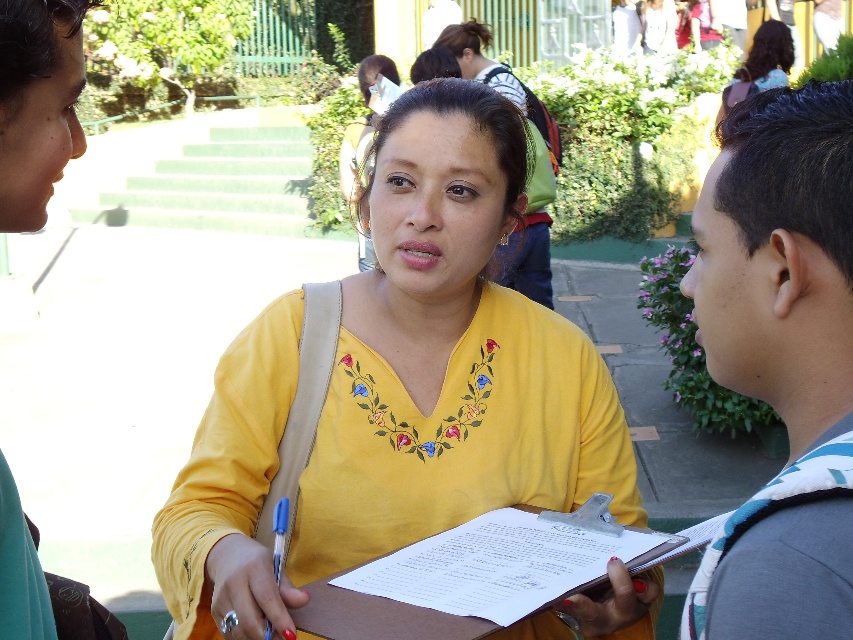
Question: Is yellow embroidered shirt at center below gray fabric backpack at right?

Choices:
 (A) yes
 (B) no

Answer: (A)

Question: Considering the real-world distances, which object is closest to the curly hair at upper right?

Choices:
 (A) brown cardboard clipboard at center
 (B) yellow embroidered shirt at center
 (C) gray fabric backpack at right

Answer: (B)

Question: Which of the following is the farthest from the observer?

Choices:
 (A) [x=735, y=298]
 (B) [x=764, y=36]

Answer: (B)

Question: Which point is closer to the camera?

Choices:
 (A) curly hair at upper right
 (B) brown cardboard clipboard at center

Answer: (B)

Question: Is gray fabric backpack at right behind brown cardboard clipboard at center?

Choices:
 (A) yes
 (B) no

Answer: (B)

Question: Can you confirm if gray fabric backpack at right is thinner than brown cardboard clipboard at center?

Choices:
 (A) yes
 (B) no

Answer: (A)